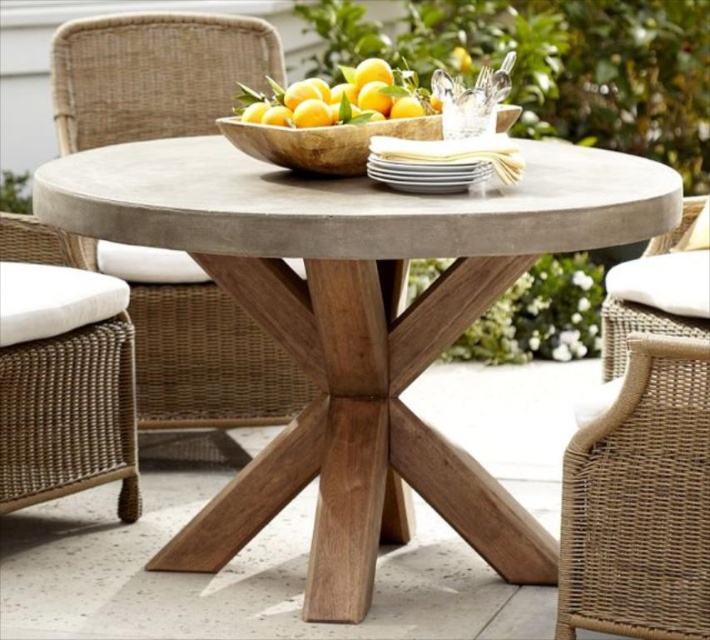
You are planning to set up a small potted plant on the matte concrete table at center. However, you notice the woven rattan chair at center is directly above it. Will the plant be visible from below the chair?

The matte concrete table at center is positioned under the woven rattan chair at center, so the plant placed on the table will be obscured by the chair from below.

You are a guest at an outdoor dinner and need to choose a seat. You want to sit in the chair that is higher up. Which chair should you choose between the woven rattan chair at center and the woven rattan chair with white cushion at lower left?

→ The woven rattan chair at center is located above the woven rattan chair with white cushion at lower left, so you should choose the woven rattan chair at center for a higher seat.